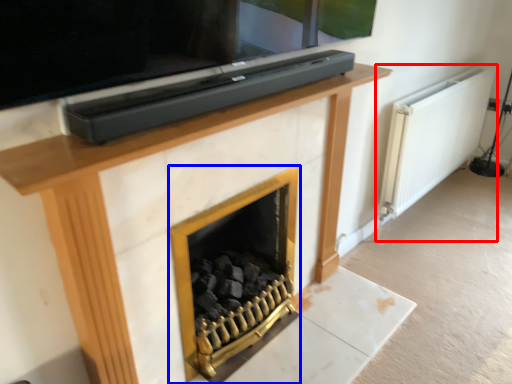
Question: Which object is further to the camera taking this photo, radiator (highlighted by a red box) or fireplace (highlighted by a blue box)?

Choices:
 (A) radiator
 (B) fireplace

Answer: (A)